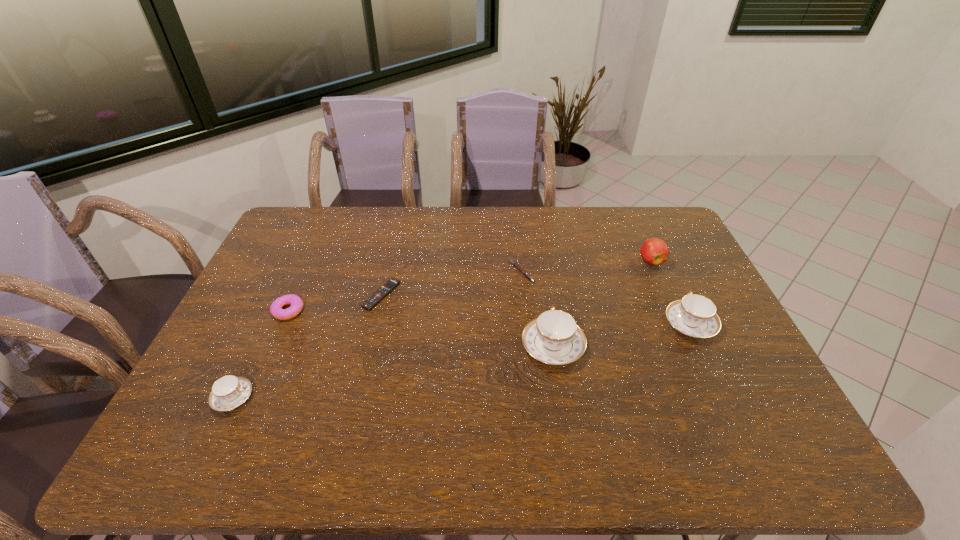
Please point a spot to place another teacup for symmetrical spacing. Please provide its 2D coordinates. Your answer should be formatted as a tuple, i.e. [(x, y)], where the tuple contains the x and y coordinates of a point satisfying the conditions above.

[(401, 370)]